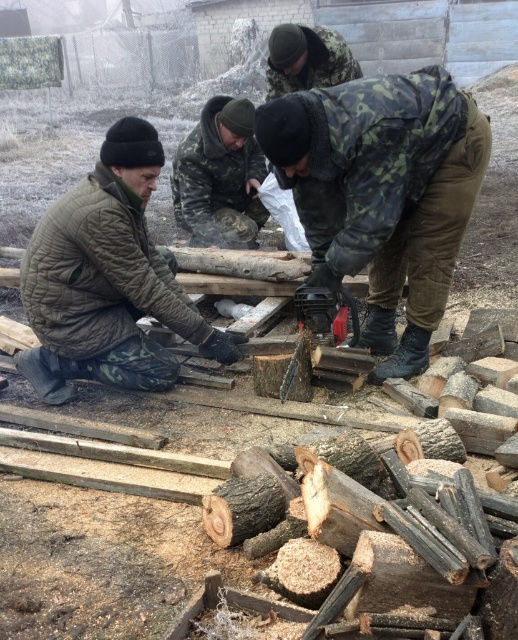
Question: Which of the following is the farthest from the observer?

Choices:
 (A) camo fabric jacket at center
 (B) camouflage fabric jacket at upper center
 (C) camouflage jacket at left

Answer: (B)

Question: Can you confirm if camouflage jacket at left is wider than camouflage fabric jacket at upper center?

Choices:
 (A) no
 (B) yes

Answer: (B)

Question: From the image, what is the correct spatial relationship of camo fabric jacket at center in relation to camouflage jacket at center?

Choices:
 (A) right
 (B) left

Answer: (A)

Question: Which point is farther to the camera?

Choices:
 (A) (274, 74)
 (B) (41, 262)
 (C) (253, 221)
 (D) (457, 147)

Answer: (C)

Question: Is camo fabric jacket at center to the left of camouflage jacket at center from the viewer's perspective?

Choices:
 (A) no
 (B) yes

Answer: (A)

Question: Among these points, which one is farthest from the camera?

Choices:
 (A) (137, 134)
 (B) (281, 65)
 (C) (175, 205)
 (D) (333, 116)

Answer: (C)